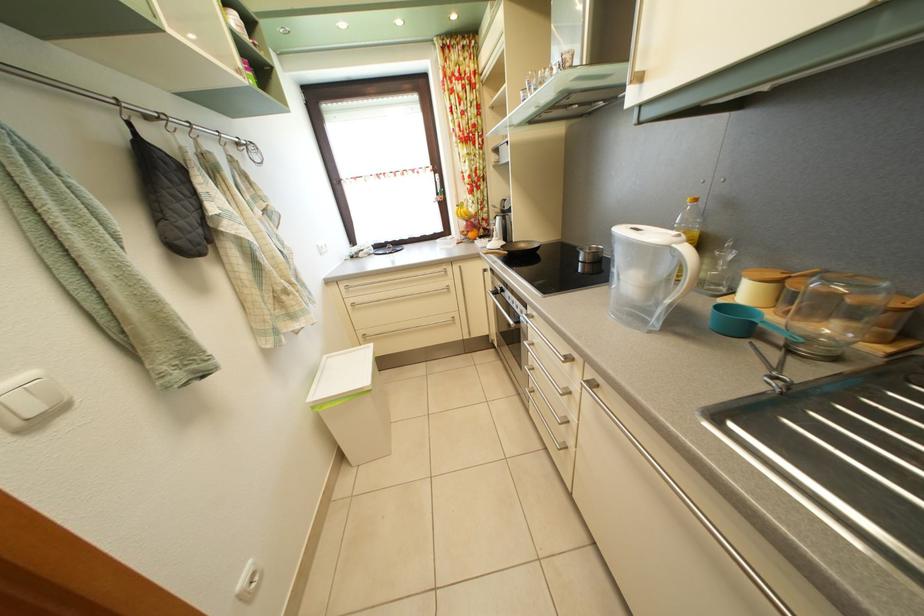
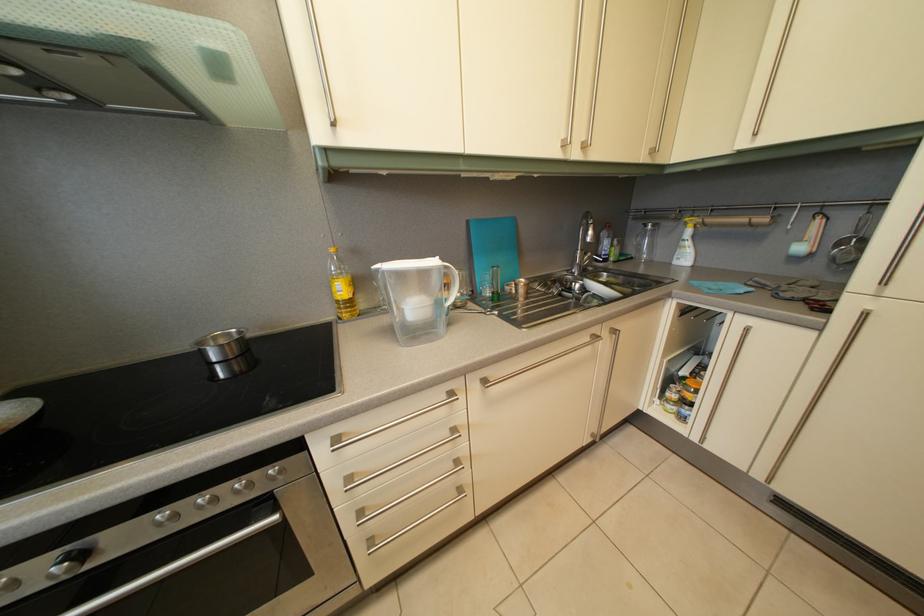
Locate, in the second image, the point that corresponds to (599,256) in the first image.

(224, 346)